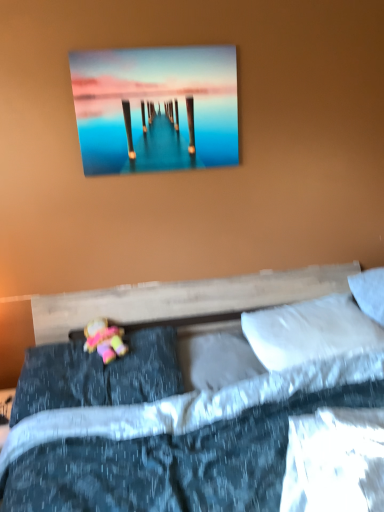
Question: Does metallic glossy pier at upper center have a lesser height compared to dark blue textured pillow at lower left, the 1th pillow in the left-to-right sequence?

Choices:
 (A) no
 (B) yes

Answer: (A)

Question: Considering the relative sizes of metallic glossy pier at upper center and dark blue textured pillow at lower left, the 1th pillow in the left-to-right sequence, in the image provided, is metallic glossy pier at upper center bigger than dark blue textured pillow at lower left, the 1th pillow in the left-to-right sequence,?

Choices:
 (A) yes
 (B) no

Answer: (B)

Question: Is metallic glossy pier at upper center thinner than dark blue textured pillow at lower left, the 1th pillow in the left-to-right sequence?

Choices:
 (A) no
 (B) yes

Answer: (B)

Question: From the image's perspective, does metallic glossy pier at upper center appear lower than dark blue textured pillow at lower left, placed as the 4th pillow when sorted from right to left?

Choices:
 (A) no
 (B) yes

Answer: (A)

Question: Is metallic glossy pier at upper center next to dark blue textured pillow at lower left, placed as the 4th pillow when sorted from right to left?

Choices:
 (A) no
 (B) yes

Answer: (A)

Question: Choose the correct answer: Is white soft pillow at center, marked as the 3th pillow in a right-to-left arrangement, inside metallic glossy pier at upper center or outside it?

Choices:
 (A) inside
 (B) outside

Answer: (B)

Question: Considering the positions of point (185, 371) and point (187, 50), is point (185, 371) closer or farther from the camera than point (187, 50)?

Choices:
 (A) farther
 (B) closer

Answer: (A)

Question: From the image's perspective, is white soft pillow at center, marked as the 3th pillow in a right-to-left arrangement, positioned above or below metallic glossy pier at upper center?

Choices:
 (A) below
 (B) above

Answer: (A)

Question: Relative to metallic glossy pier at upper center, is white soft pillow at center, marked as the 3th pillow in a right-to-left arrangement, in front or behind?

Choices:
 (A) front
 (B) behind

Answer: (A)

Question: Relative to dark blue textured pillow at lower left, the 1th pillow in the left-to-right sequence, is white soft pillow at center, marked as the 3th pillow in a right-to-left arrangement, in front or behind?

Choices:
 (A) front
 (B) behind

Answer: (B)

Question: Does point (238, 375) appear closer or farther from the camera than point (130, 365)?

Choices:
 (A) farther
 (B) closer

Answer: (B)

Question: Based on their positions, is white soft pillow at center, marked as the 3th pillow in a right-to-left arrangement, located to the left or right of dark blue textured pillow at lower left, placed as the 4th pillow when sorted from right to left?

Choices:
 (A) left
 (B) right

Answer: (B)

Question: From a real-world perspective, is white soft pillow at center, which is the second pillow in left-to-right order, positioned above or below dark blue textured pillow at lower left, placed as the 4th pillow when sorted from right to left?

Choices:
 (A) below
 (B) above

Answer: (A)

Question: From the image's perspective, is pastel fabric doll at lower left located above or below metallic glossy pier at upper center?

Choices:
 (A) below
 (B) above

Answer: (A)

Question: From a real-world perspective, is pastel fabric doll at lower left positioned above or below metallic glossy pier at upper center?

Choices:
 (A) above
 (B) below

Answer: (B)